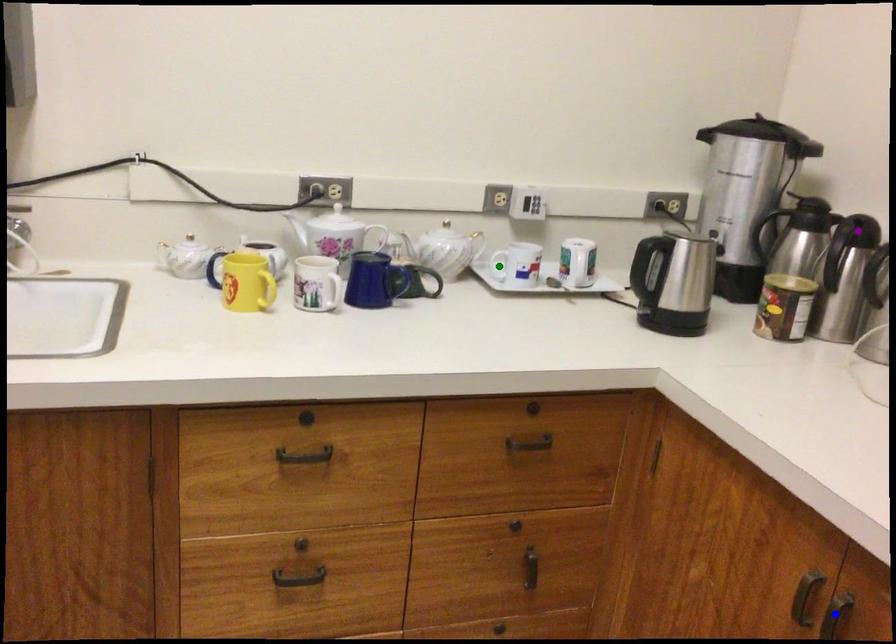
Order these from nearest to farthest:
green point | blue point | purple point

blue point
purple point
green point